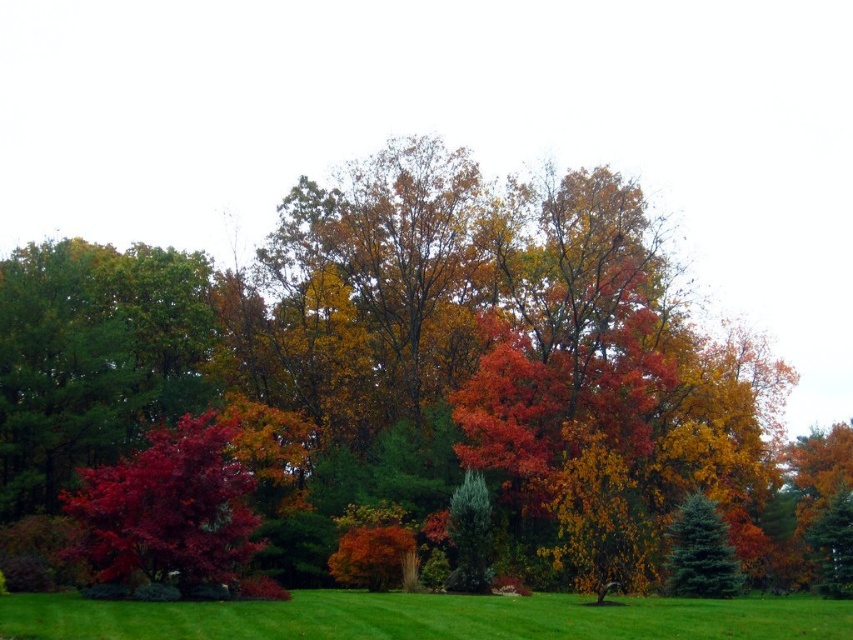
You are a bird looking for a higher perch to survey the autumn park. You see the shiny red maple at center and the glossy red tree at left. Which tree should you choose to get a better view?

The shiny red maple at center is much taller than the glossy red tree at left, so choosing it will provide a higher perch and a better view of the autumn park.

You are standing in the park and want to take a photo of the glossy red tree at left. Where should you position yourself to capture it in the frame?

To capture the glossy red tree at left in your photo, position yourself so that the tree is centered at the coordinates approximately 0.794 on the horizontal axis and 0.197 on the vertical axis relative to the image frame.

You are standing in the park and want to take a photo of the shiny red maple at center. If your camera has a maximum focus range of 20 meters, will you need to move closer to the tree to get a clear shot?

The shiny red maple at center is 22.27 meters away from the viewer. Since the camera can only focus up to 20 meters, you need to move closer to ensure the tree is within the focus range.